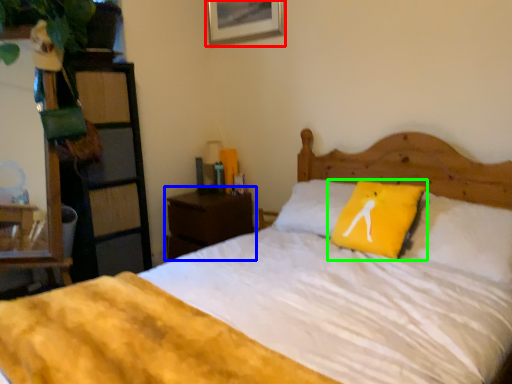
Question: Which object is positioned farthest from picture frame (highlighted by a red box)? Select from nightstand (highlighted by a blue box) and pillow (highlighted by a green box).

Choices:
 (A) nightstand
 (B) pillow

Answer: (B)